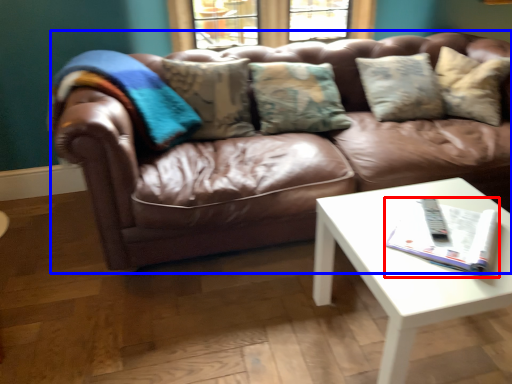
Question: Which object appears closest to the camera in this image, magazine (highlighted by a red box) or studio couch (highlighted by a blue box)?

Choices:
 (A) magazine
 (B) studio couch

Answer: (A)